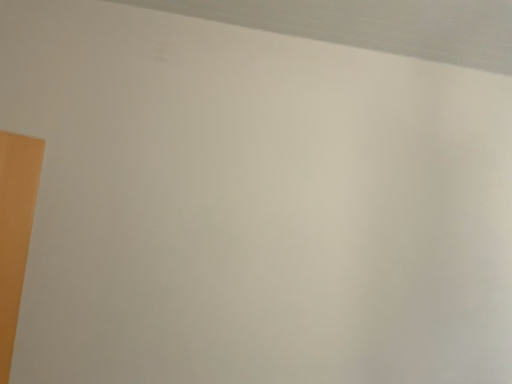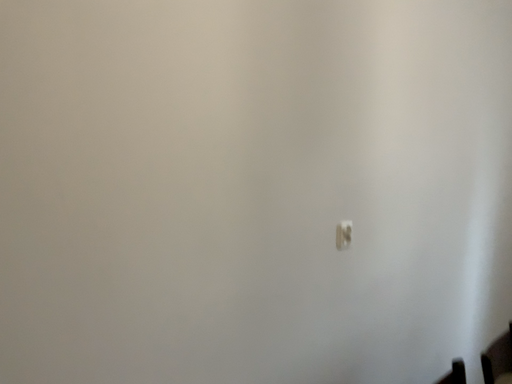
Question: Which way did the camera rotate in the video?

Choices:
 (A) rotated right
 (B) rotated left

Answer: (A)